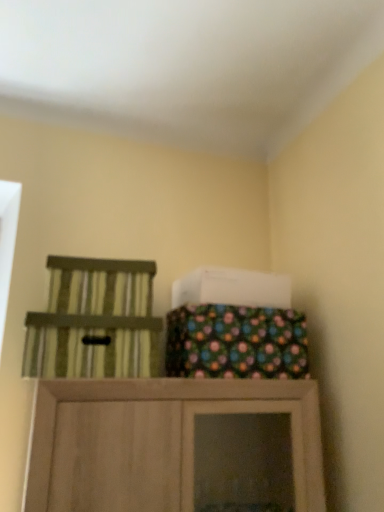
Question: Considering the positions of green striped chair at left and polka dot fabric bag at upper center in the image, is green striped chair at left bigger or smaller than polka dot fabric bag at upper center?

Choices:
 (A) big
 (B) small

Answer: (B)

Question: In terms of height, does green striped chair at left look taller or shorter compared to polka dot fabric bag at upper center?

Choices:
 (A) short
 (B) tall

Answer: (A)

Question: Would you say green striped chair at left is inside or outside polka dot fabric bag at upper center?

Choices:
 (A) inside
 (B) outside

Answer: (B)

Question: In the image, is polka dot fabric bag at upper center on the left side or the right side of green striped chair at left?

Choices:
 (A) right
 (B) left

Answer: (A)

Question: From the image's perspective, is polka dot fabric bag at upper center positioned above or below green striped chair at left?

Choices:
 (A) below
 (B) above

Answer: (B)

Question: Considering the positions of point (210, 310) and point (147, 318), is point (210, 310) closer or farther from the camera than point (147, 318)?

Choices:
 (A) closer
 (B) farther

Answer: (B)

Question: Which is correct: polka dot fabric bag at upper center is inside green striped chair at left, or outside of it?

Choices:
 (A) outside
 (B) inside

Answer: (A)